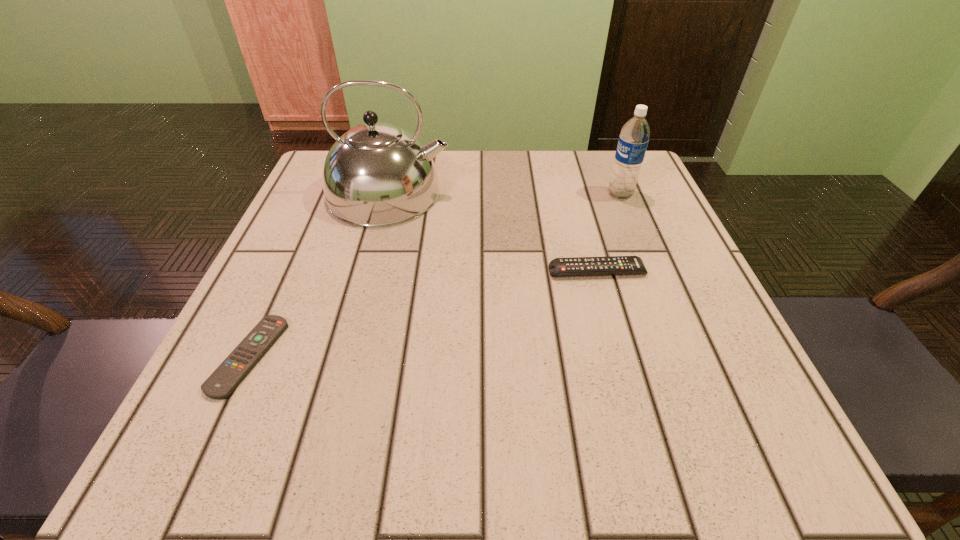
At what (x,y) coordinates should I click in order to perform the action: click on kettle positioned at the far edge. Please return your answer as a coordinate pair (x, y). The height and width of the screenshot is (540, 960). Looking at the image, I should click on (377, 174).

The image size is (960, 540). Identify the location of water bottle present at the far edge. (634, 137).

Identify the location of kettle present at the left edge. (377, 174).

The width and height of the screenshot is (960, 540). I want to click on remote control located in the left edge section of the desktop, so click(231, 372).

Find the location of a particular element. This screenshot has height=540, width=960. water bottle that is at the right edge is located at coordinates (634, 137).

Where is `remote control present at the right edge`? remote control present at the right edge is located at coordinates (611, 265).

This screenshot has width=960, height=540. Find the location of `object at the far left corner`. object at the far left corner is located at coordinates pos(377,174).

In order to click on object that is at the far right corner in this screenshot , I will do `click(634, 137)`.

Find the location of a particular element. The width and height of the screenshot is (960, 540). free spot at the far edge of the desktop is located at coordinates (516, 170).

This screenshot has width=960, height=540. Find the location of `vacant space at the near edge of the desktop`. vacant space at the near edge of the desktop is located at coordinates (459, 412).